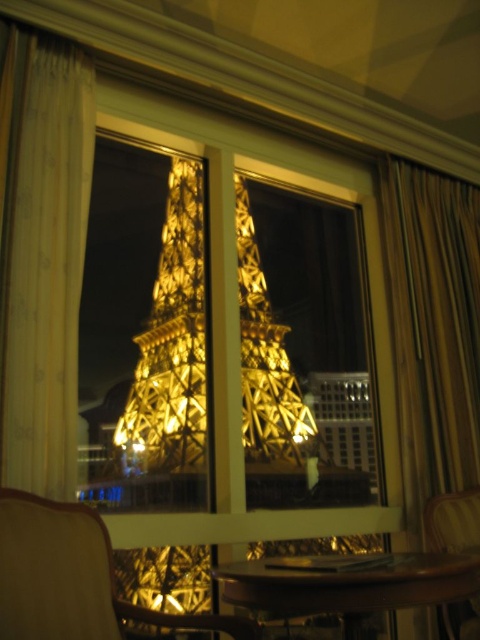
You are sitting in the wooden armchair at lower left and want to place a book on the wooden table at center. Can you reach the table from your current position without moving your chair?

The wooden armchair at lower left is in front of the wooden table at center, so you are facing the table and can likely reach it by extending your arm or leaning forward slightly.